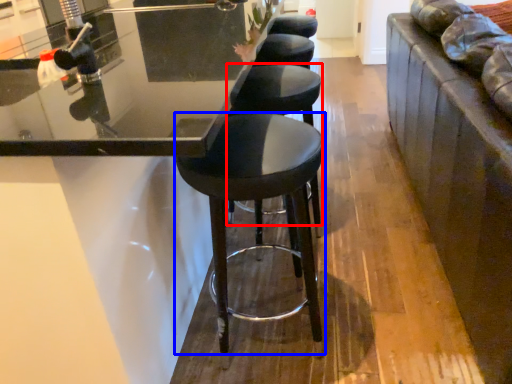
Question: Which point is closer to the camera, stool (highlighted by a red box) or stool (highlighted by a blue box)?

Choices:
 (A) stool
 (B) stool

Answer: (B)